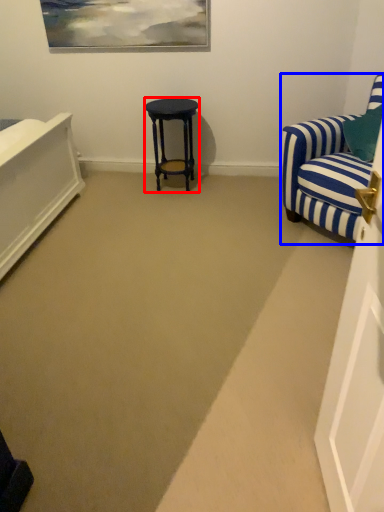
Question: Which point is closer to the camera, stool (highlighted by a red box) or chair (highlighted by a blue box)?

Choices:
 (A) stool
 (B) chair

Answer: (B)